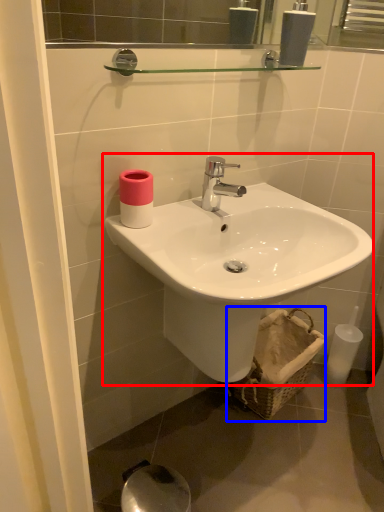
Question: Which object appears farthest to the camera in this image, sink (highlighted by a red box) or basket (highlighted by a blue box)?

Choices:
 (A) sink
 (B) basket

Answer: (B)